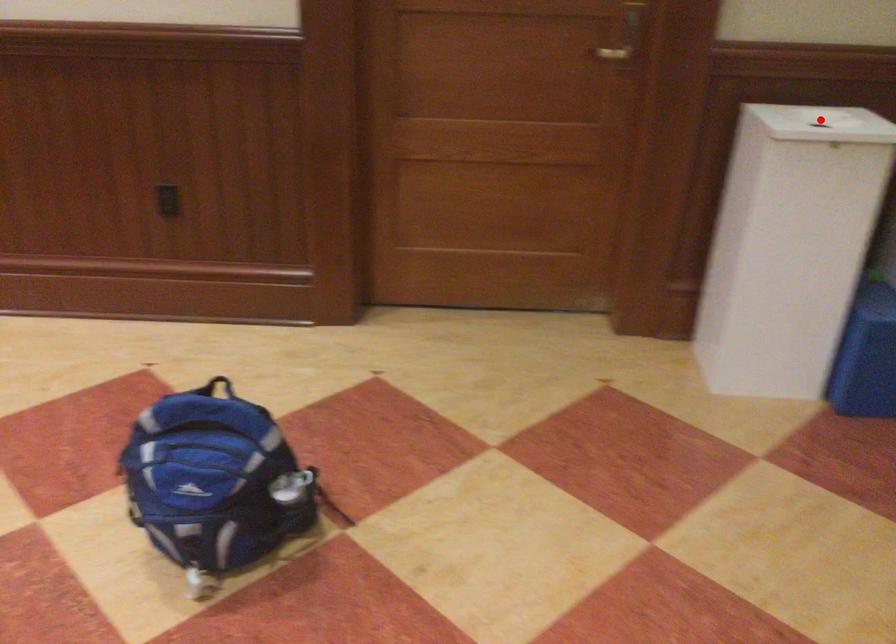
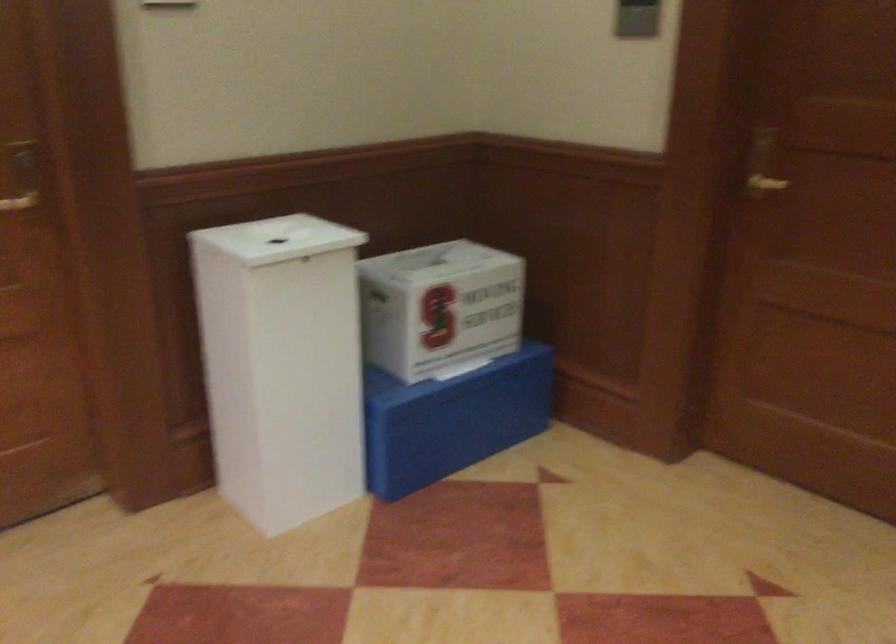
The point at the highlighted location is marked in the first image. Where is the corresponding point in the second image?

(277, 238)